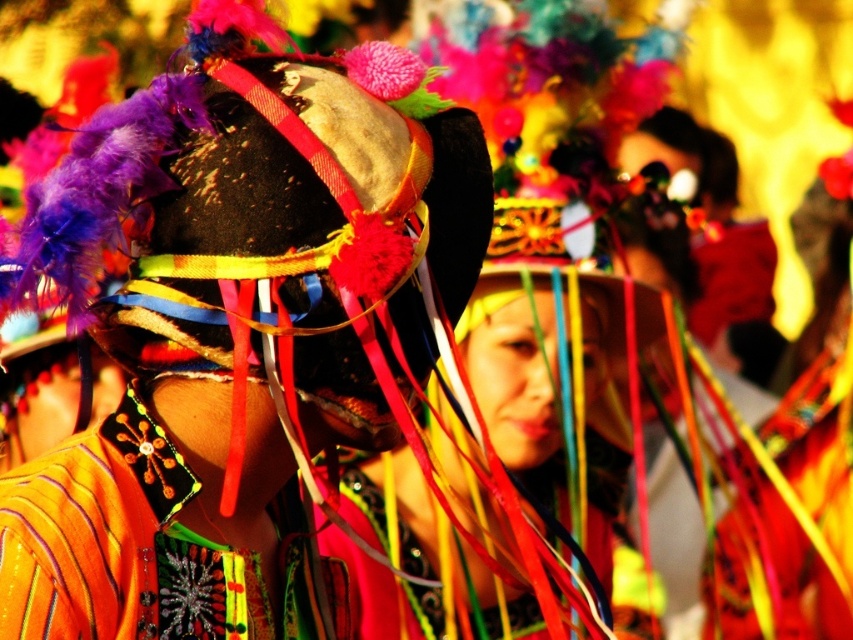
Question: Among these points, which one is nearest to the camera?

Choices:
 (A) pyautogui.click(x=529, y=307)
 (B) pyautogui.click(x=167, y=524)

Answer: (B)

Question: Which object is closer to the camera taking this photo?

Choices:
 (A) matte black headdress at center
 (B) orange fabric necklace at center

Answer: (B)

Question: Where is matte black headdress at center located in relation to orange fabric necklace at center in the image?

Choices:
 (A) below
 (B) above

Answer: (B)

Question: Is matte black headdress at center below orange fabric necklace at center?

Choices:
 (A) yes
 (B) no

Answer: (B)

Question: Which point appears closest to the camera in this image?

Choices:
 (A) (596, 538)
 (B) (74, 605)

Answer: (B)

Question: Can you confirm if matte black headdress at center is wider than orange fabric necklace at center?

Choices:
 (A) yes
 (B) no

Answer: (A)